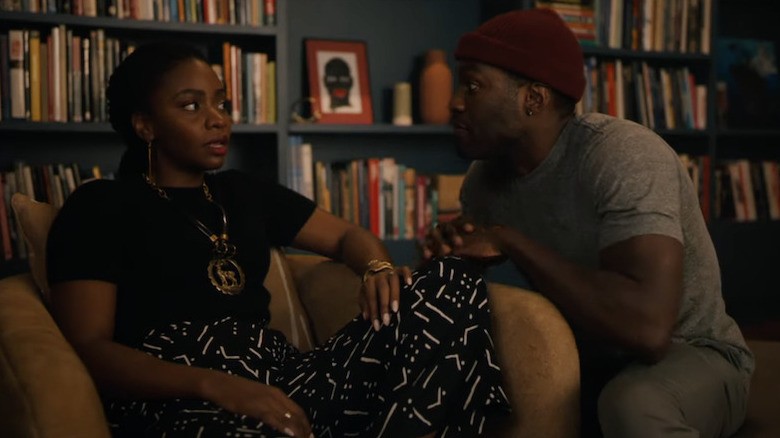
You are a GUI agent. You are given a task and a screenshot of the screen. Output one action in this format:
    pyautogui.click(x=<x>, y=<y>)
    Task: Click on the wall
    The width and height of the screenshot is (780, 438).
    Given the screenshot: What is the action you would take?
    pyautogui.click(x=387, y=45)